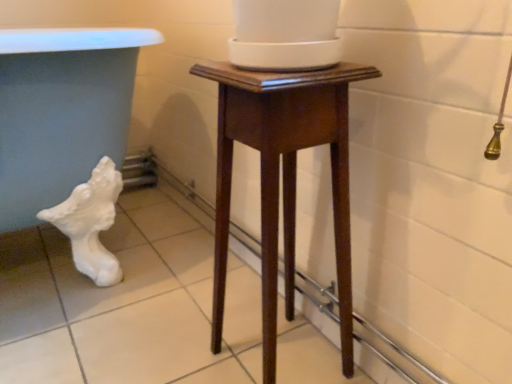
Locate an element on the screen. This screenshot has width=512, height=384. vacant space underneath mahogany wood pedestal at center (from a real-world perspective) is located at coordinates (278, 363).